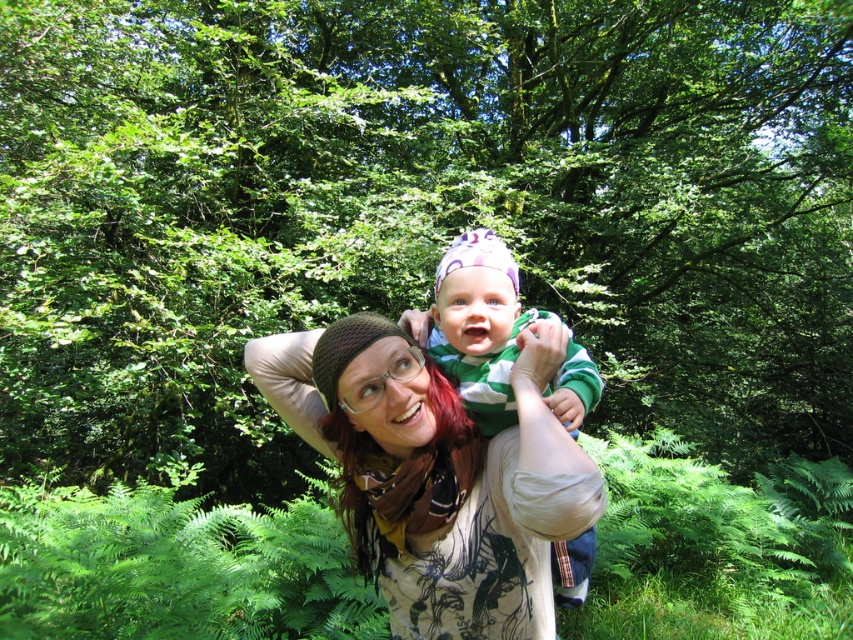
Who is taller, matte brown knitted hat at center or green striped sweater at center?

green striped sweater at center

Does matte brown knitted hat at center come in front of green striped sweater at center?

That is True.

Describe the element at coordinates (434, 474) in the screenshot. I see `matte brown knitted hat at center` at that location.

Locate an element on the screen. matte brown knitted hat at center is located at coordinates (434, 474).